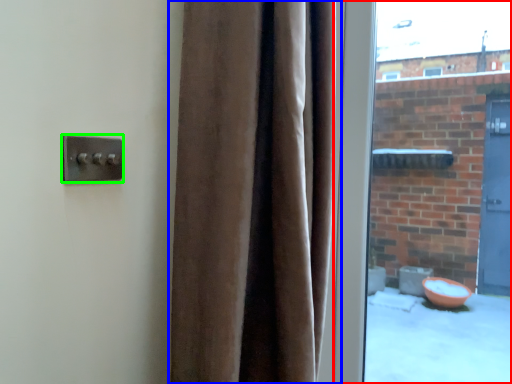
Question: Considering the real-world distances, which object is closest to window (highlighted by a red box)? curtain (highlighted by a blue box) or door handle (highlighted by a green box).

Choices:
 (A) curtain
 (B) door handle

Answer: (A)